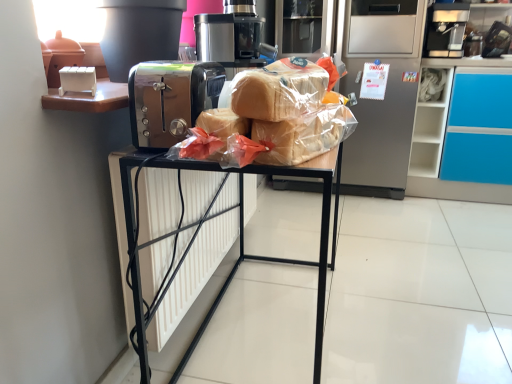
The image size is (512, 384). Describe the element at coordinates (170, 99) in the screenshot. I see `satin chrome toaster at center` at that location.

What is the approximate height of translucent plastic bread at center?

The height of translucent plastic bread at center is 12.23 centimeters.

Locate an element on the screen. Image resolution: width=512 pixels, height=384 pixels. translucent plastic bread at center is located at coordinates (279, 90).

The width and height of the screenshot is (512, 384). I want to click on silver metallic refrigerator at center, so click(x=385, y=91).

Locate an element on the screen. The height and width of the screenshot is (384, 512). black plastic coffee machine at upper right is located at coordinates (446, 30).

Can you confirm if black plastic coffee machine at upper right is bigger than metallic black toaster at center?

Incorrect, black plastic coffee machine at upper right is not larger than metallic black toaster at center.

Considering the positions of objects black plastic coffee machine at upper right and metallic black toaster at center in the image provided, who is more to the left, black plastic coffee machine at upper right or metallic black toaster at center?

From the viewer's perspective, metallic black toaster at center appears more on the left side.

Which point is more forward, (445, 20) or (242, 231)?

Positioned in front is point (242, 231).

From the image's perspective, is black plastic coffee machine at upper right on satin chrome toaster at center?

Indeed, from the image's perspective, black plastic coffee machine at upper right is shown above satin chrome toaster at center.

Can you confirm if black plastic coffee machine at upper right is bigger than satin chrome toaster at center?

Yes.

Is black plastic coffee machine at upper right taller than satin chrome toaster at center?

Yes, black plastic coffee machine at upper right is taller than satin chrome toaster at center.

Is black plastic coffee machine at upper right facing towards satin chrome toaster at center?

No, black plastic coffee machine at upper right is not turned towards satin chrome toaster at center.

Is translucent plastic bread at center situated inside satin chrome toaster at center or outside?

The correct answer is: outside.

Is the position of translucent plastic bread at center more distant than that of satin chrome toaster at center?

No.

Is translucent plastic bread at center positioned far away from satin chrome toaster at center?

They are positioned close to each other.

From the image's perspective, is silver metallic refrigerator at center above translucent plastic bread at center?

Yes, from the image's perspective, silver metallic refrigerator at center is over translucent plastic bread at center.

Looking at the image, does silver metallic refrigerator at center seem bigger or smaller compared to translucent plastic bread at center?

Considering their sizes, silver metallic refrigerator at center takes up more space than translucent plastic bread at center.

Is silver metallic refrigerator at center behind translucent plastic bread at center?

That is True.

Which point is more forward, (378, 187) or (284, 59)?

The point (284, 59) is in front.

Relative to black plastic coffee machine at upper right, is metallic black toaster at center in front or behind?

metallic black toaster at center is in front of black plastic coffee machine at upper right.

Looking at this image, is metallic black toaster at center positioned far away from black plastic coffee machine at upper right?

Absolutely, metallic black toaster at center is distant from black plastic coffee machine at upper right.

Can you confirm if metallic black toaster at center is smaller than black plastic coffee machine at upper right?

No.

Could you tell me if metallic black toaster at center is turned towards satin chrome toaster at center?

No, metallic black toaster at center is not oriented towards satin chrome toaster at center.

From a real-world perspective, is metallic black toaster at center on top of satin chrome toaster at center?

Incorrect, from a real-world perspective, metallic black toaster at center is lower than satin chrome toaster at center.

Does metallic black toaster at center touch satin chrome toaster at center?

metallic black toaster at center and satin chrome toaster at center are not in contact.

Is satin chrome toaster at center far away from translucent plastic bread at center?

Actually, satin chrome toaster at center and translucent plastic bread at center are a little close together.

From the picture: From the image's perspective, which one is positioned lower, satin chrome toaster at center or translucent plastic bread at center?

satin chrome toaster at center is shown below in the image.

From a real-world perspective, who is located lower, satin chrome toaster at center or translucent plastic bread at center?

satin chrome toaster at center is physically lower.

Is satin chrome toaster at center located outside translucent plastic bread at center?

That's correct, satin chrome toaster at center is outside of translucent plastic bread at center.

You are a GUI agent. You are given a task and a screenshot of the screen. Output one action in this format:
    pyautogui.click(x=<x>, y=<y>)
    Task: Click on the coffee machine on the right of metallic black toaster at center
    This screenshot has height=384, width=512.
    Given the screenshot: What is the action you would take?
    pyautogui.click(x=446, y=30)

The width and height of the screenshot is (512, 384). I want to click on home appliance below the black plastic coffee machine at upper right (from a real-world perspective), so click(170, 99).

From the image, which object appears to be farther from satin chrome toaster at center, black plastic coffee machine at upper right or silver metallic refrigerator at center?

black plastic coffee machine at upper right lies further to satin chrome toaster at center than the other object.

In the scene shown: When comparing their distances from satin chrome toaster at center, does translucent plastic bread at center or metallic black toaster at center seem closer?

translucent plastic bread at center.

Which object lies further to the anchor point satin chrome toaster at center, silver metallic refrigerator at center or metallic black toaster at center?

silver metallic refrigerator at center lies further to satin chrome toaster at center than the other object.

Looking at the image, which one is located further to black plastic coffee machine at upper right, satin chrome toaster at center or translucent plastic bread at center?

The object further to black plastic coffee machine at upper right is satin chrome toaster at center.

From the image, which object appears to be nearer to metallic black toaster at center, silver metallic refrigerator at center or black plastic coffee machine at upper right?

silver metallic refrigerator at center is closer to metallic black toaster at center.

Which object lies nearer to the anchor point translucent plastic bread at center, satin chrome toaster at center or black plastic coffee machine at upper right?

The object closer to translucent plastic bread at center is satin chrome toaster at center.

Based on their spatial positions, is satin chrome toaster at center or translucent plastic bread at center further from metallic black toaster at center?

translucent plastic bread at center is further to metallic black toaster at center.

When comparing their distances from translucent plastic bread at center, does satin chrome toaster at center or metallic black toaster at center seem closer?

satin chrome toaster at center is closer to translucent plastic bread at center.

You are a GUI agent. You are given a task and a screenshot of the screen. Output one action in this format:
    pyautogui.click(x=<x>, y=<y>)
    Task: Click on the home appliance positioned between metallic black toaster at center and black plastic coffee machine at upper right from near to far
    The height and width of the screenshot is (384, 512).
    Given the screenshot: What is the action you would take?
    pyautogui.click(x=170, y=99)

Where is `furniture between translucent plastic bread at center and black plastic coffee machine at upper right in the front-back direction`? furniture between translucent plastic bread at center and black plastic coffee machine at upper right in the front-back direction is located at coordinates (284, 258).

You are a GUI agent. You are given a task and a screenshot of the screen. Output one action in this format:
    pyautogui.click(x=<x>, y=<y>)
    Task: Click on the home appliance that lies between translucent plastic bread at center and metallic black toaster at center from top to bottom
    The image size is (512, 384).
    Given the screenshot: What is the action you would take?
    pyautogui.click(x=170, y=99)

Where is `furniture between translucent plastic bread at center and silver metallic refrigerator at center from front to back`? The width and height of the screenshot is (512, 384). furniture between translucent plastic bread at center and silver metallic refrigerator at center from front to back is located at coordinates (284, 258).